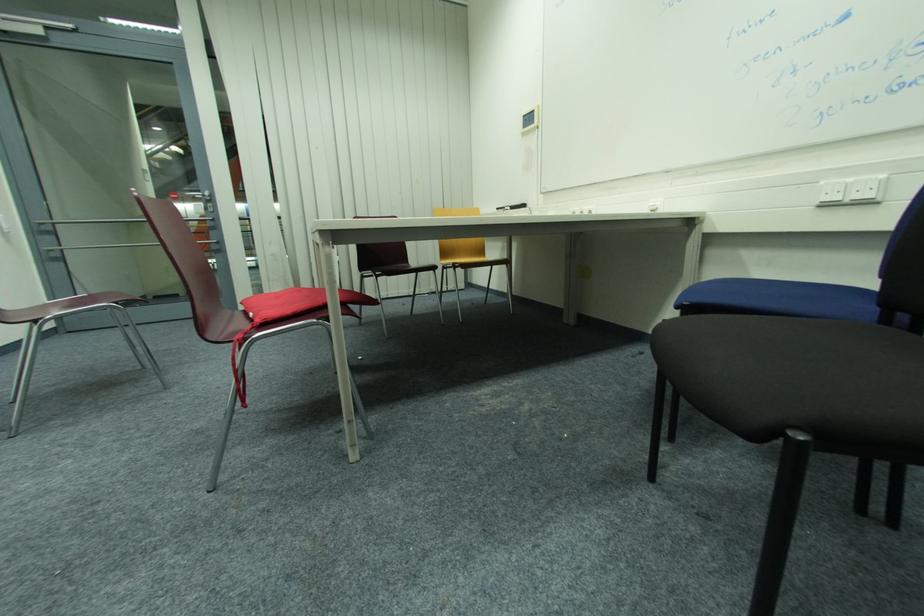
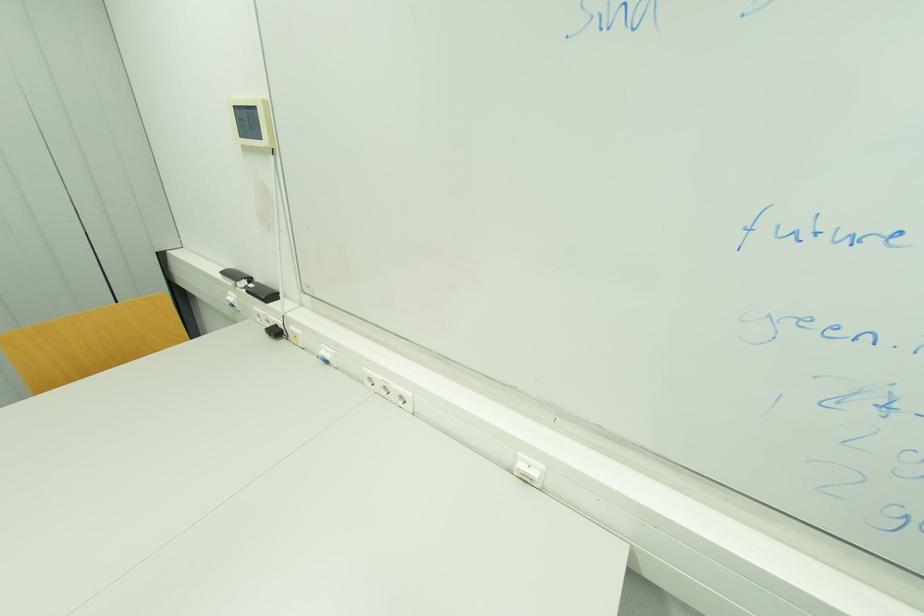
Find the pixel in the second image that matches (x=528, y=118) in the first image.

(237, 108)